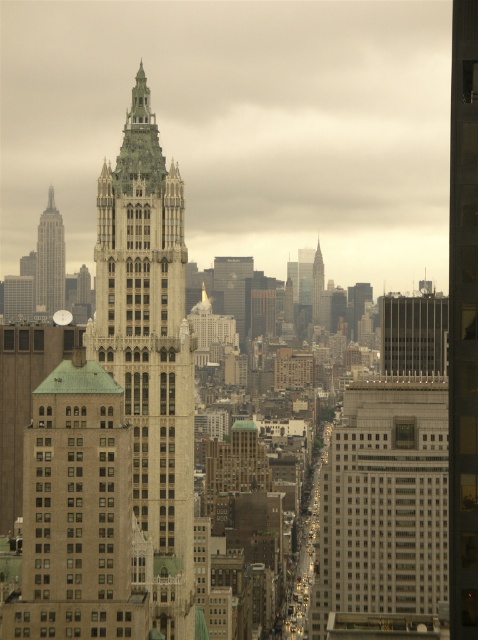
Can you confirm if green stone tower at center is bigger than brown brick building at center?

Yes, green stone tower at center is bigger than brown brick building at center.

Measure the distance between green stone tower at center and brown brick building at center.

21.84 meters

This screenshot has height=640, width=478. Identify the location of green stone tower at center. (150, 352).

Between green stone tower at center and green glass skyscraper at center, which one has less height?

With less height is green glass skyscraper at center.

Describe the element at coordinates (150, 352) in the screenshot. This screenshot has height=640, width=478. I see `green stone tower at center` at that location.

Locate an element on the screen. green stone tower at center is located at coordinates (150, 352).

Between green stone tower at center and matte silver sphere at center, which one is positioned higher?

matte silver sphere at center

Is green stone tower at center closer to the viewer compared to matte silver sphere at center?

Yes, it is in front of matte silver sphere at center.

Who is more distant from viewer, (125, 177) or (64, 288)?

The point (64, 288) is behind.

Where is `green stone tower at center`? Image resolution: width=478 pixels, height=640 pixels. green stone tower at center is located at coordinates (150, 352).